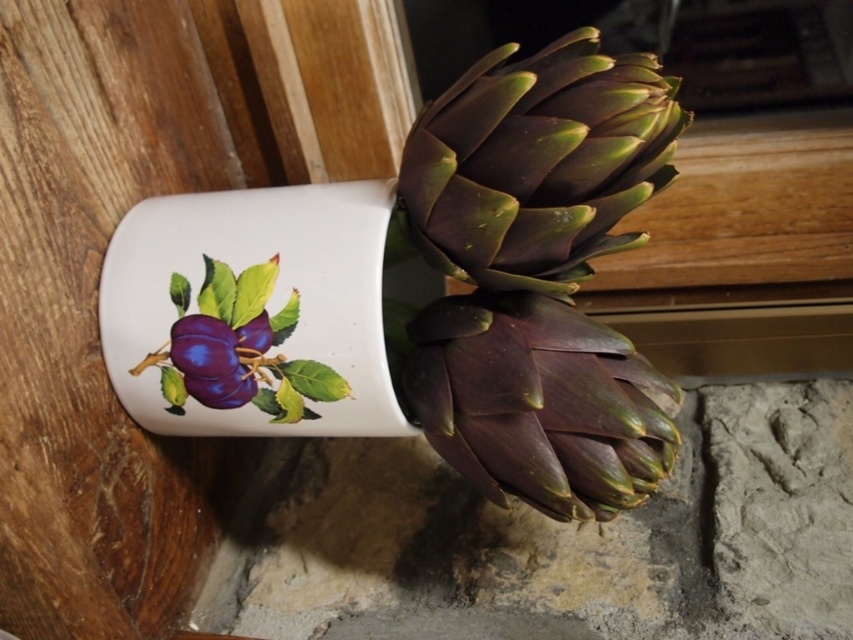
Question: Estimate the real-world distances between objects in this image. Which object is closer to the dark green leafy artichoke at center?

Choices:
 (A) matte purple plum at center
 (B) dark purple leafy artichoke at center

Answer: (B)

Question: Estimate the real-world distances between objects in this image. Which object is farther from the matte purple plum at center?

Choices:
 (A) dark purple leafy artichoke at center
 (B) dark green leafy artichoke at center

Answer: (B)

Question: Does dark green leafy artichoke at center have a smaller size compared to matte purple plum at center?

Choices:
 (A) no
 (B) yes

Answer: (A)

Question: Based on their relative distances, which object is nearer to the matte purple plum at center?

Choices:
 (A) dark green leafy artichoke at center
 (B) dark purple leafy artichoke at center

Answer: (B)

Question: Is dark green leafy artichoke at center in front of matte purple plum at center?

Choices:
 (A) no
 (B) yes

Answer: (B)

Question: Is the position of dark green leafy artichoke at center less distant than that of dark purple leafy artichoke at center?

Choices:
 (A) no
 (B) yes

Answer: (B)